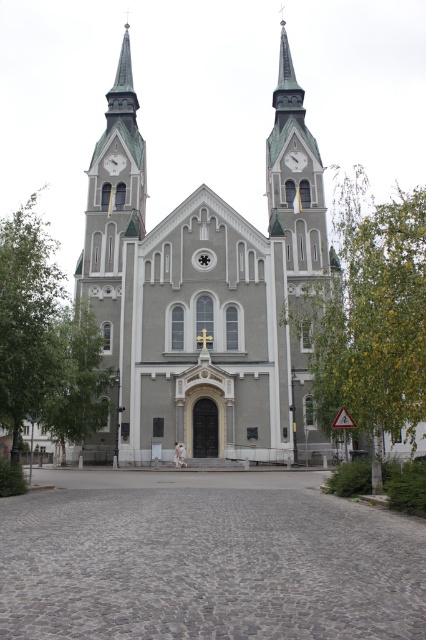
Question: Can you confirm if gray stone church at center is positioned above green leafy tree at left?

Choices:
 (A) yes
 (B) no

Answer: (A)

Question: Does gray stone church at center appear under green leafy tree at center?

Choices:
 (A) no
 (B) yes

Answer: (A)

Question: Considering the relative positions of green leafy tree at left and white glossy clock at upper center in the image provided, where is green leafy tree at left located with respect to white glossy clock at upper center?

Choices:
 (A) above
 (B) below

Answer: (B)

Question: Estimate the real-world distances between objects in this image. Which object is closer to the green textured spire at center?

Choices:
 (A) green leafy tree at left
 (B) green leafy tree at center
 (C) white glossy clock at upper center
 (D) gray stone church at center

Answer: (D)

Question: Estimate the real-world distances between objects in this image. Which object is closer to the green leafy tree at center?

Choices:
 (A) green leafy tree at left
 (B) white glossy clock at upper center
 (C) gray stone church at center

Answer: (C)

Question: Which of the following is the farthest from the observer?

Choices:
 (A) (271, 380)
 (B) (322, 360)

Answer: (B)